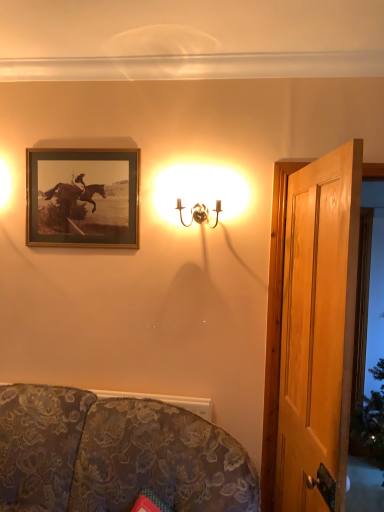
Question: Can you see wooden door at right touching gold metallic wall sconce at upper center?

Choices:
 (A) no
 (B) yes

Answer: (A)

Question: Are wooden door at right and gold metallic wall sconce at upper center far apart?

Choices:
 (A) yes
 (B) no

Answer: (B)

Question: From a real-world perspective, is wooden door at right under gold metallic wall sconce at upper center?

Choices:
 (A) no
 (B) yes

Answer: (B)

Question: Is gold metallic wall sconce at upper center located within wooden door at right?

Choices:
 (A) no
 (B) yes

Answer: (A)

Question: Considering the relative sizes of wooden door at right and gold metallic wall sconce at upper center in the image provided, is wooden door at right thinner than gold metallic wall sconce at upper center?

Choices:
 (A) yes
 (B) no

Answer: (A)

Question: Does point (269, 274) appear closer or farther from the camera than point (379, 224)?

Choices:
 (A) closer
 (B) farther

Answer: (B)

Question: Considering the relative positions of wooden door at right and transparent glass door at right in the image provided, is wooden door at right to the left or to the right of transparent glass door at right?

Choices:
 (A) right
 (B) left

Answer: (B)

Question: From the image's perspective, is wooden door at right above or below transparent glass door at right?

Choices:
 (A) below
 (B) above

Answer: (B)

Question: Is wooden door at right bigger or smaller than transparent glass door at right?

Choices:
 (A) big
 (B) small

Answer: (B)

Question: From the image's perspective, relative to wooden door at right, is gold-framed print at upper left above or below?

Choices:
 (A) below
 (B) above

Answer: (B)

Question: Based on their sizes in the image, would you say gold-framed print at upper left is bigger or smaller than wooden door at right?

Choices:
 (A) big
 (B) small

Answer: (B)

Question: Is point (33, 158) positioned closer to the camera than point (281, 440)?

Choices:
 (A) farther
 (B) closer

Answer: (A)

Question: In the image, is gold-framed print at upper left positioned in front of or behind wooden door at right?

Choices:
 (A) behind
 (B) front

Answer: (A)

Question: Is point (34, 160) closer or farther from the camera than point (69, 425)?

Choices:
 (A) closer
 (B) farther

Answer: (B)

Question: From a real-world perspective, is gold-framed print at upper left above or below floral fabric couch at lower left?

Choices:
 (A) below
 (B) above

Answer: (B)